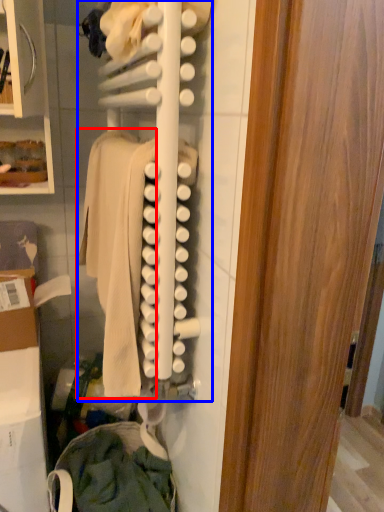
Question: Which object is further to the camera taking this photo, clothing (highlighted by a red box) or closet (highlighted by a blue box)?

Choices:
 (A) clothing
 (B) closet

Answer: (A)